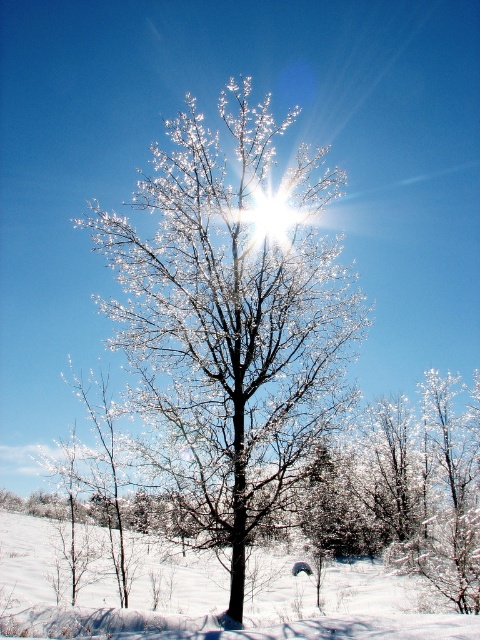
Consider the image. Is snowy branches at center above white powdery snow at lower center?

Yes.

Is snowy branches at center to the right of white powdery snow at lower center from the viewer's perspective?

In fact, snowy branches at center is to the left of white powdery snow at lower center.

The image size is (480, 640). Identify the location of snowy branches at center. (230, 323).